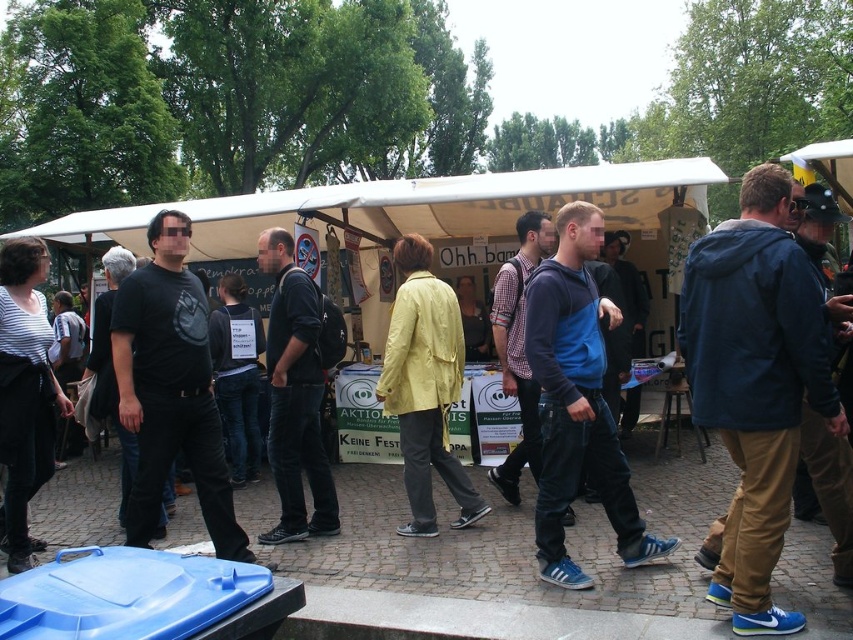
You are a photographer trying to capture a candid shot of the dark blue leather jacket at center without including the blue fleece jacket at center in the frame. Is this possible given their positions?

The blue fleece jacket at center is in front of the dark blue leather jacket at center, so it would block the view of the dark blue leather jacket at center. Therefore, it is not possible to capture the dark blue leather jacket at center without the blue fleece jacket at center overlapping in the shot.